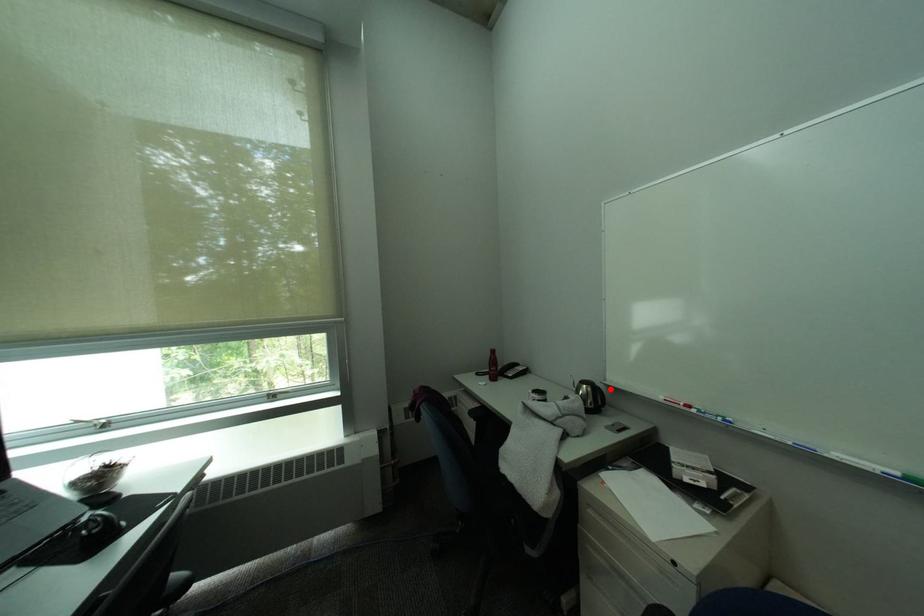
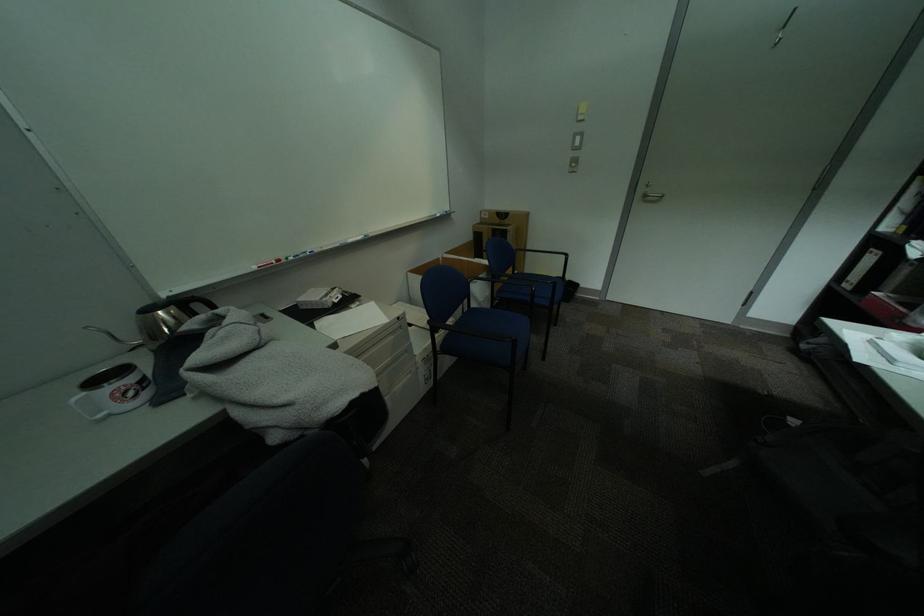
Locate, in the second image, the point that corresponds to the highlighted location in the first image.

(204, 297)